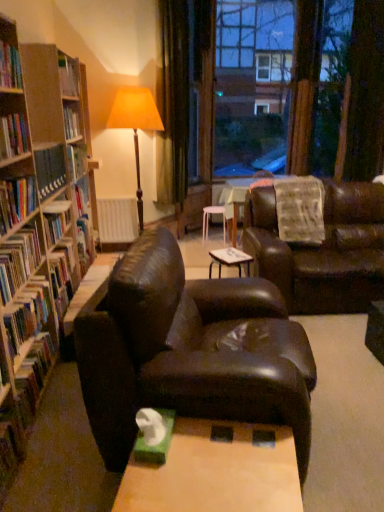
Where is `empty space that is ontop of wooden table at center (from a real-world perspective)`? empty space that is ontop of wooden table at center (from a real-world perspective) is located at coordinates (210, 469).